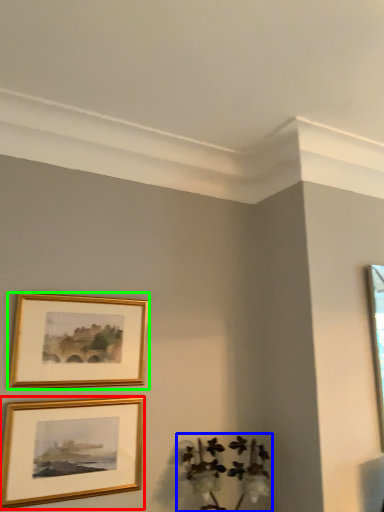
Question: Based on their relative distances, which object is nearer to picture frame (highlighted by a red box)? Choose from plant (highlighted by a blue box) and picture frame (highlighted by a green box).

Choices:
 (A) plant
 (B) picture frame

Answer: (B)